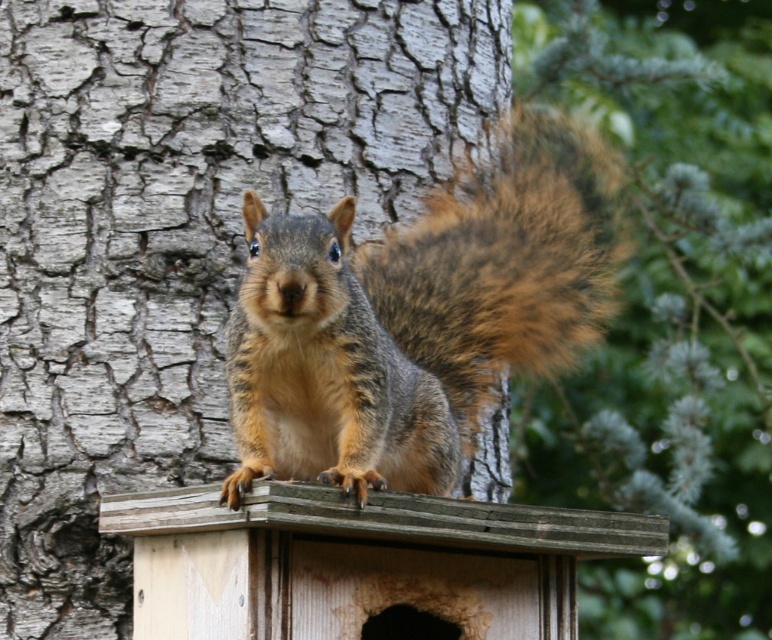
Does brown textured fur at upper center appear under wooden bird feeder at center?

Incorrect, brown textured fur at upper center is not positioned below wooden bird feeder at center.

Does brown textured fur at upper center appear over wooden bird feeder at center?

Yes, brown textured fur at upper center is above wooden bird feeder at center.

Where is `brown textured fur at upper center`? This screenshot has height=640, width=772. brown textured fur at upper center is located at coordinates (666, 310).

Can you confirm if gray rough bark tree trunk at center is positioned below wooden bird feeder at center?

No, gray rough bark tree trunk at center is not below wooden bird feeder at center.

Which is more to the left, gray rough bark tree trunk at center or wooden bird feeder at center?

gray rough bark tree trunk at center is more to the left.

This screenshot has width=772, height=640. Identify the location of gray rough bark tree trunk at center. (181, 232).

Which is more to the left, gray rough bark tree trunk at center or brown textured fur at upper center?

gray rough bark tree trunk at center is more to the left.

Which of these two, gray rough bark tree trunk at center or brown textured fur at upper center, stands taller?

brown textured fur at upper center is taller.

Where is `gray rough bark tree trunk at center`? The image size is (772, 640). gray rough bark tree trunk at center is located at coordinates [181, 232].

Locate an element on the screen. gray rough bark tree trunk at center is located at coordinates (181, 232).